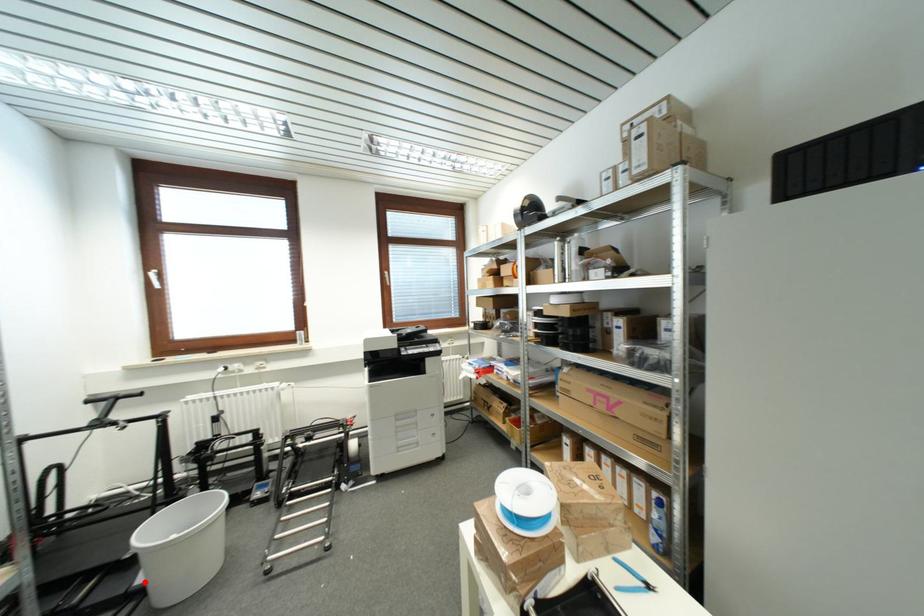
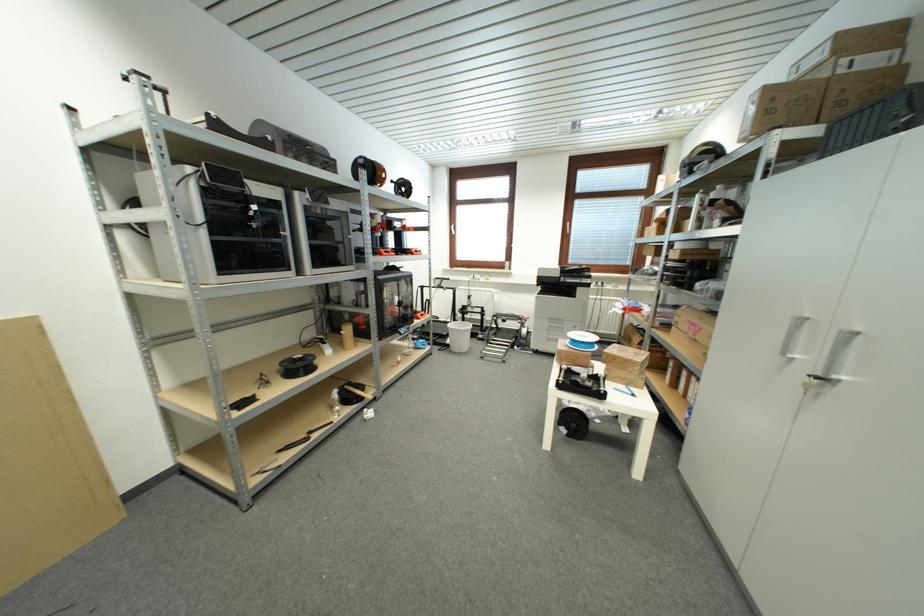
Question: I am providing you with two images of the same scene from different viewpoints. A red point is shown in image1. For the corresponding object point in image2, is it positioned nearer or farther from the camera?

Choices:
 (A) Nearer
 (B) Farther

Answer: (B)